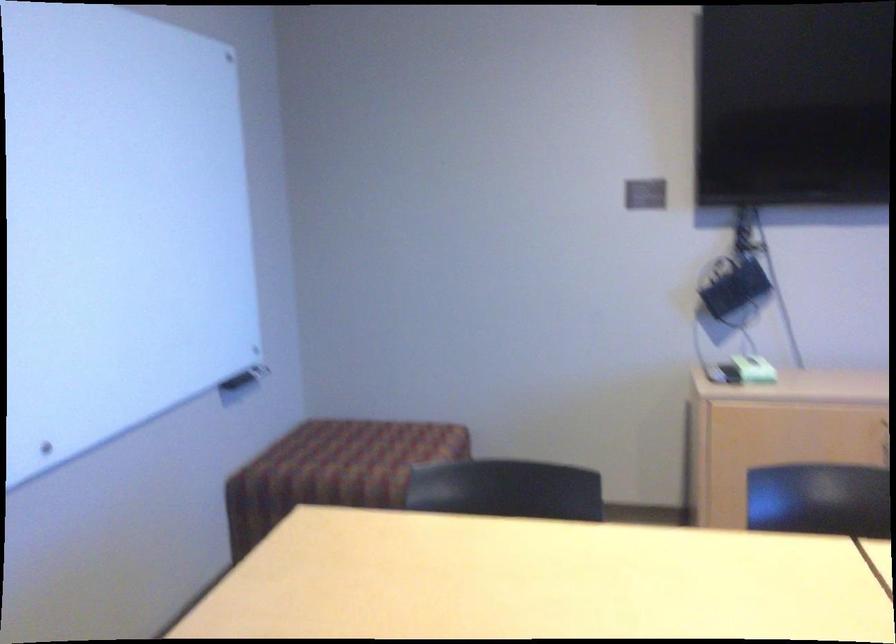
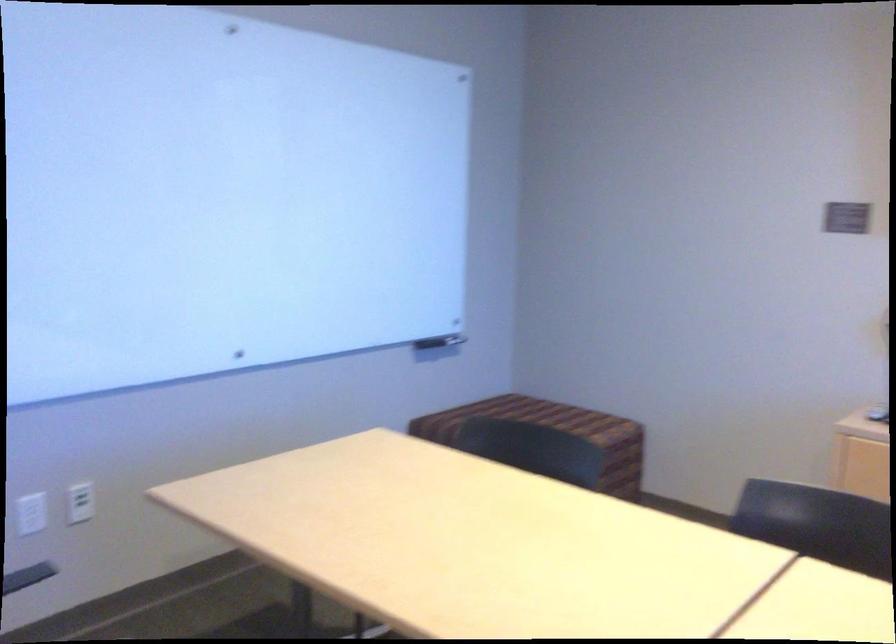
Question: The images are taken continuously from a first-person perspective. In which direction are you moving?

Choices:
 (A) Left
 (B) Right
 (C) Forward
 (D) Backward

Answer: (B)